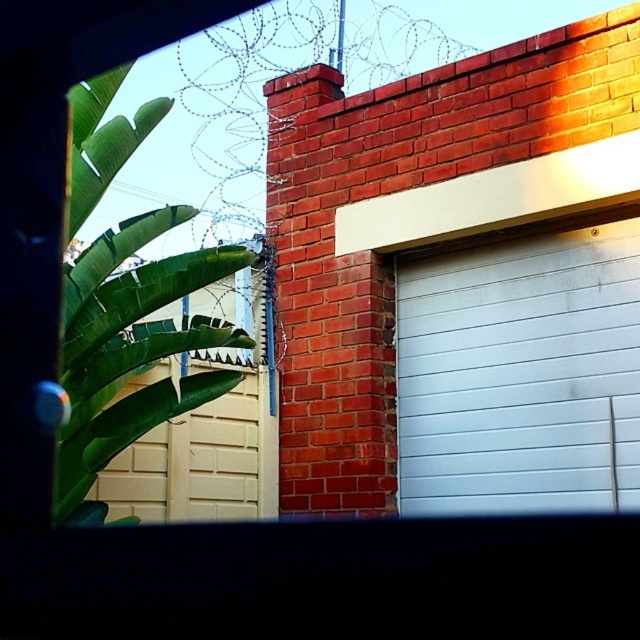
Measure the distance between white smooth garage door at center and green leafy plant at left.

A distance of 5.35 feet exists between white smooth garage door at center and green leafy plant at left.

Who is higher up, white smooth garage door at center or green leafy plant at left?

green leafy plant at left is above.

Between point (563, 371) and point (141, 390), which one is positioned behind?

The point (563, 371) is more distant.

Identify the location of white smooth garage door at center. (520, 376).

Is green leafy plant at left behind beige textured garage door at lower left?

That is False.

Does green leafy plant at left appear on the left side of beige textured garage door at lower left?

Correct, you'll find green leafy plant at left to the left of beige textured garage door at lower left.

Where is `green leafy plant at left`? green leafy plant at left is located at coordinates pyautogui.click(x=131, y=349).

Which of these two, white smooth garage door at center or beige textured garage door at lower left, stands taller?

Standing taller between the two is white smooth garage door at center.

Is white smooth garage door at center in front of beige textured garage door at lower left?

Yes, it is in front of beige textured garage door at lower left.

The width and height of the screenshot is (640, 640). What do you see at coordinates (520, 376) in the screenshot? I see `white smooth garage door at center` at bounding box center [520, 376].

Identify the location of white smooth garage door at center. The height and width of the screenshot is (640, 640). [x=520, y=376].